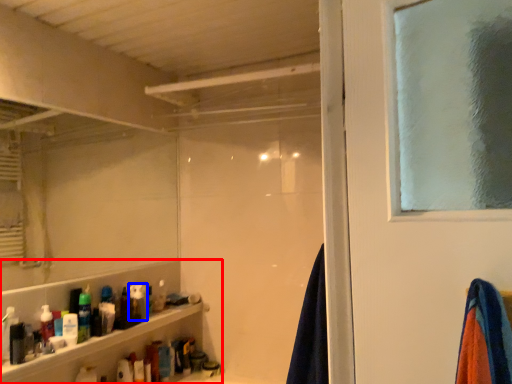
Question: Among these objects, which one is farthest to the camera, shelf (highlighted by a red box) or toiletry (highlighted by a blue box)?

Choices:
 (A) shelf
 (B) toiletry

Answer: (B)